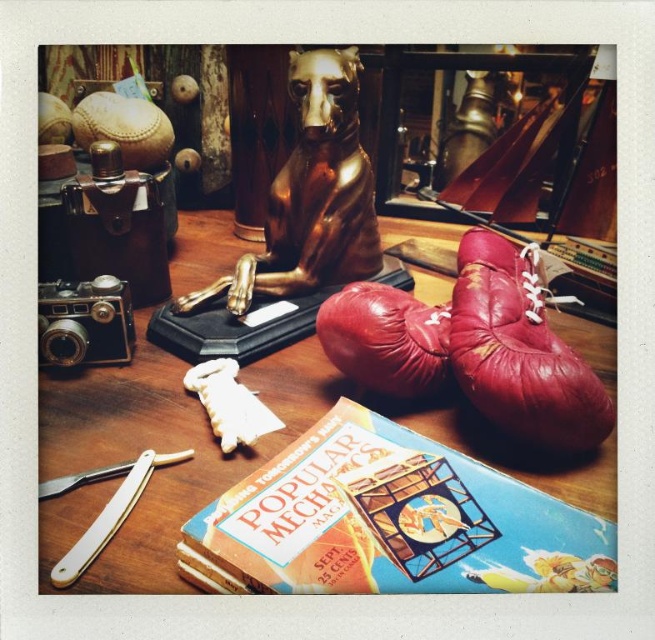
Question: Does wooden table at center appear on the right side of gold shiny statue at center?

Choices:
 (A) yes
 (B) no

Answer: (A)

Question: Which of the following is the closest to the observer?

Choices:
 (A) gold shiny statue at center
 (B) matte paper book at center

Answer: (B)

Question: Which point appears closest to the camera in this image?

Choices:
 (A) (320, 90)
 (B) (297, 396)
 (C) (546, 321)
 (D) (252, 588)

Answer: (D)

Question: Is gold shiny statue at center further to camera compared to white plastic razor at lower left?

Choices:
 (A) yes
 (B) no

Answer: (A)

Question: Is matte paper book at center smaller than leather boxing glove at right?

Choices:
 (A) no
 (B) yes

Answer: (B)

Question: Among these points, which one is farthest from the camera?

Choices:
 (A) (83, 560)
 (B) (305, 280)

Answer: (B)